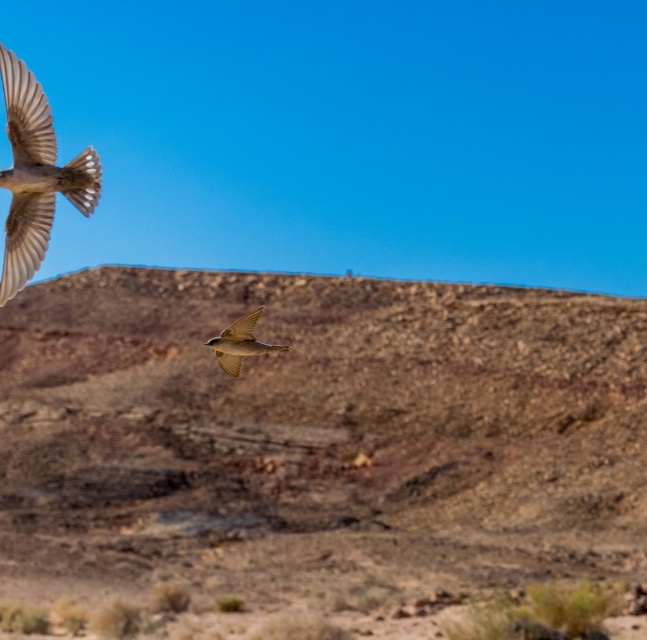
Who is more forward, [410,522] or [226,360]?

Point [226,360] is more forward.

Is point (428, 320) more distant than point (239, 332)?

Yes.

Locate an element on the screen. brown rocky terrain at center is located at coordinates (320, 428).

Can you confirm if brown feathered bird at upper left is taller than brown feathered bird at center?

Indeed, brown feathered bird at upper left has a greater height compared to brown feathered bird at center.

Which is below, brown feathered bird at upper left or brown feathered bird at center?

brown feathered bird at center is lower down.

Which is behind, point (1, 280) or point (234, 353)?

The point (1, 280) is behind.

The width and height of the screenshot is (647, 640). I want to click on brown feathered bird at upper left, so click(36, 173).

Does point (395, 310) come closer to viewer compared to point (38, 177)?

No.

Who is lower down, brown rocky terrain at center or brown feathered bird at upper left?

brown rocky terrain at center is lower down.

Is point (455, 492) closer to camera compared to point (47, 152)?

No, (455, 492) is further to viewer.

Image resolution: width=647 pixels, height=640 pixels. Find the location of `brown rocky terrain at center`. brown rocky terrain at center is located at coordinates (320, 428).